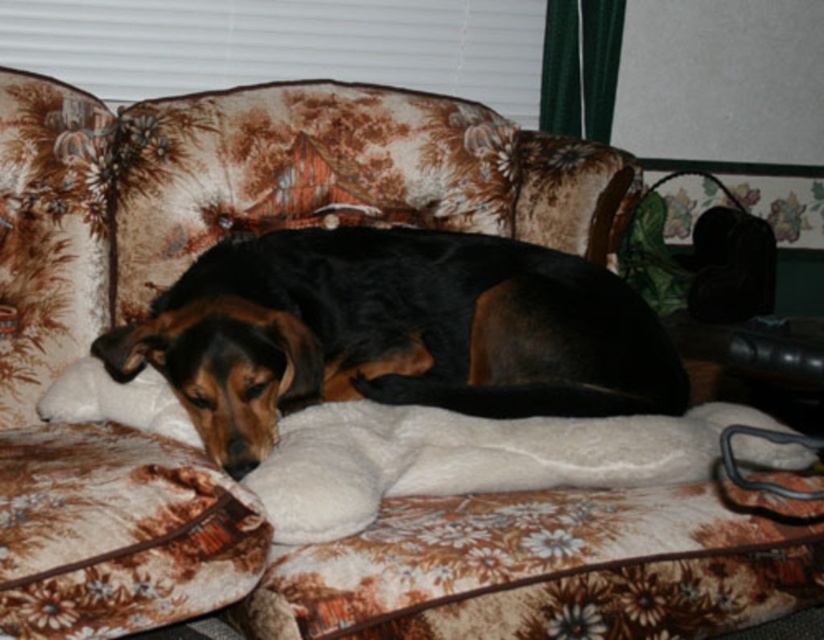
You are a photographer trying to capture the black fur dog at center. The floral fabric couch at center is blocking your view. Can you move the couch to get a clear shot of the dog?

The floral fabric couch at center is positioned over black fur dog at center, so moving the couch would reveal the dog, allowing you to take a clear shot.

You are a photographer trying to capture a clear shot of the black fur dog at center. However, the floral fabric couch at center is blocking your view. Can you move the couch to get a better angle?

The floral fabric couch at center is in front of the black fur dog at center, so moving the couch would allow you to see the dog more clearly.

You are standing in the living room and want to place a new rug in front of the floral fabric couch at center. According to the coordinates provided, where should you position the rug relative to the couch?

The floral fabric couch at center is located at point coordinates (181,269), so you should position the rug in front of it at those coordinates.